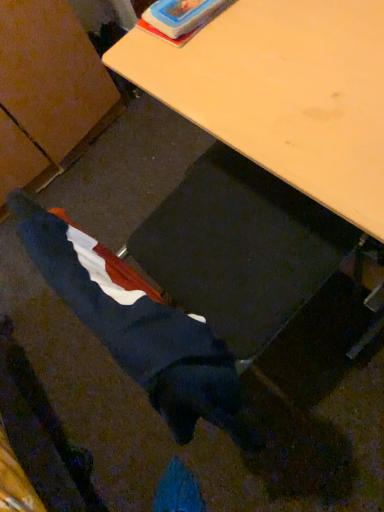
Question: Would you say wooden desk at center is to the left or to the right of velvet blue coat at lower left in the picture?

Choices:
 (A) left
 (B) right

Answer: (B)

Question: Is point (228, 38) closer or farther from the camera than point (185, 413)?

Choices:
 (A) closer
 (B) farther

Answer: (B)

Question: In terms of size, does wooden desk at center appear bigger or smaller than velvet blue coat at lower left?

Choices:
 (A) big
 (B) small

Answer: (A)

Question: Is velvet blue coat at lower left taller or shorter than wooden desk at center?

Choices:
 (A) short
 (B) tall

Answer: (A)

Question: Considering the relative positions of velvet blue coat at lower left and wooden desk at center in the image provided, is velvet blue coat at lower left to the left or to the right of wooden desk at center?

Choices:
 (A) left
 (B) right

Answer: (A)

Question: Looking at their shapes, would you say velvet blue coat at lower left is wider or thinner than wooden desk at center?

Choices:
 (A) thin
 (B) wide

Answer: (A)

Question: Is point (188, 428) closer or farther from the camera than point (122, 53)?

Choices:
 (A) farther
 (B) closer

Answer: (B)